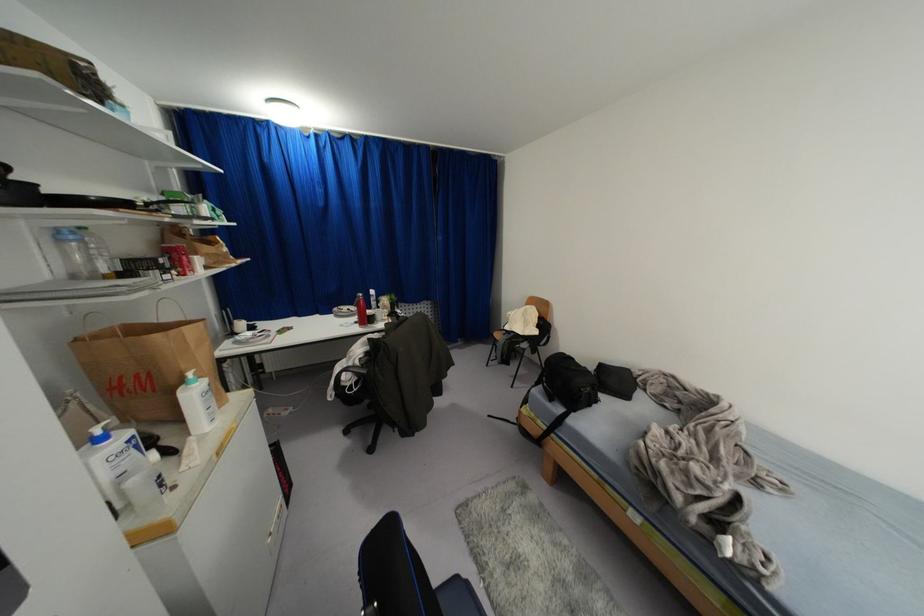
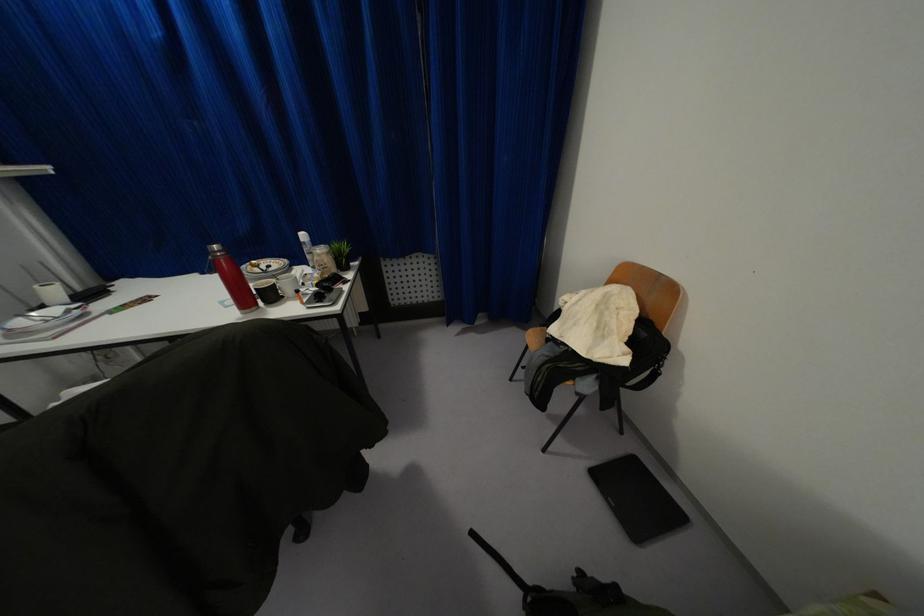
The point at [241,323] is marked in the first image. Where is the corresponding point in the second image?

(53, 291)